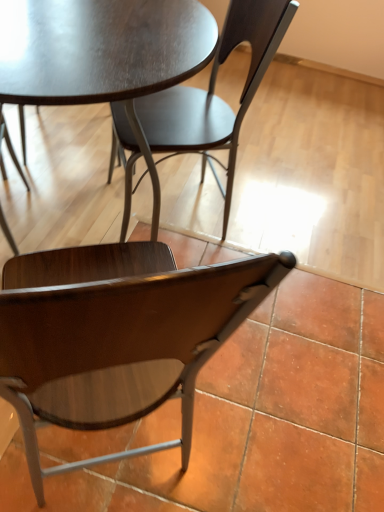
Image resolution: width=384 pixels, height=512 pixels. Find the location of `free region under wooden chair at lower center, the second chair in the top-to-bottom sequence (from a real-world perspective)`. free region under wooden chair at lower center, the second chair in the top-to-bottom sequence (from a real-world perspective) is located at coordinates (119, 451).